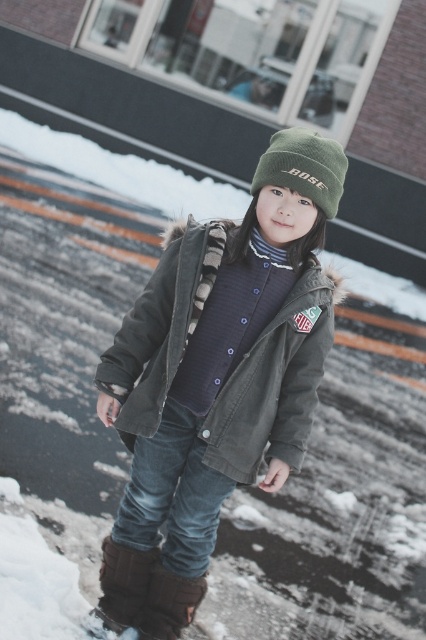
Locate an element on the screen. The width and height of the screenshot is (426, 640). green knit beanie at center is located at coordinates (304, 168).

Does green knit beanie at center have a greater height compared to brown suede boot at lower left?

Indeed, green knit beanie at center has a greater height compared to brown suede boot at lower left.

Does point (296, 125) lie behind point (126, 586)?

Yes, it is.

You are a GUI agent. You are given a task and a screenshot of the screen. Output one action in this format:
    pyautogui.click(x=<x>, y=<y>)
    Task: Click on the green knit beanie at center
    This screenshot has width=426, height=640.
    Given the screenshot: What is the action you would take?
    pyautogui.click(x=304, y=168)

Which is more to the left, olive corduroy jacket at center or green knit beanie at center?

From the viewer's perspective, olive corduroy jacket at center appears more on the left side.

Is olive corduroy jacket at center to the left of green knit beanie at center from the viewer's perspective?

Correct, you'll find olive corduroy jacket at center to the left of green knit beanie at center.

Who is more distant from viewer, (192, 259) or (319, 154)?

Point (192, 259)

At what (x,y) coordinates should I click in order to perform the action: click on olive corduroy jacket at center. Please return your answer as a coordinate pair (x, y). The width and height of the screenshot is (426, 640). Looking at the image, I should click on (273, 384).

Between point (222, 400) and point (97, 618), which one is positioned behind?

Positioned behind is point (97, 618).

Is point (227, 230) positioned after point (100, 625)?

No, (227, 230) is in front of (100, 625).

Is point (141, 397) farther from viewer compared to point (109, 634)?

No, it is in front of (109, 634).

The height and width of the screenshot is (640, 426). Find the location of `olive corduroy jacket at center`. olive corduroy jacket at center is located at coordinates (273, 384).